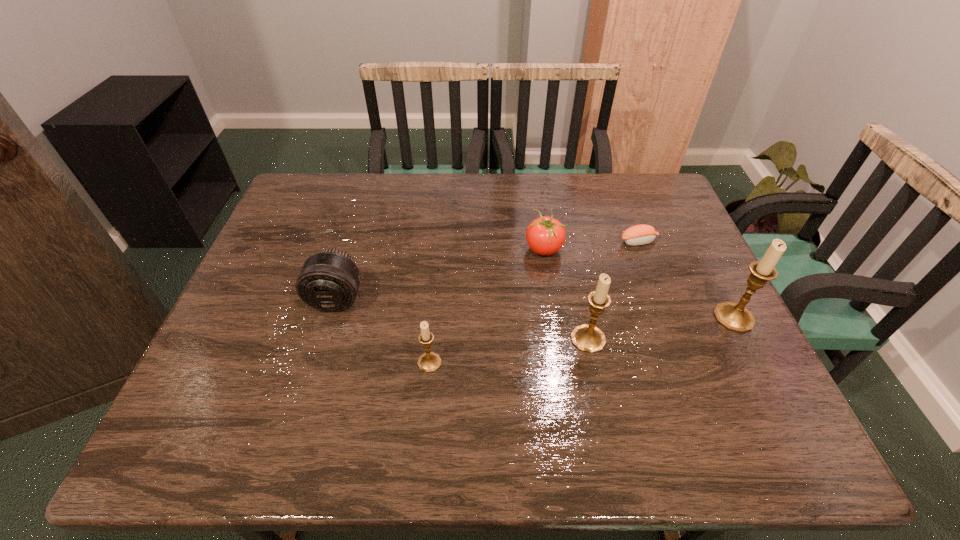
Identify the location of free space at the left edge of the desktop. (293, 248).

The height and width of the screenshot is (540, 960). Find the location of `free space at the right edge`. free space at the right edge is located at coordinates tap(673, 277).

This screenshot has width=960, height=540. What are the coordinates of `free space at the far right corner` in the screenshot? It's located at (644, 215).

You are a GUI agent. You are given a task and a screenshot of the screen. Output one action in this format:
    pyautogui.click(x=<x>, y=<y>)
    Task: Click on the vacant space that's between the shortest object and the rightmost object
    The image size is (960, 540).
    Given the screenshot: What is the action you would take?
    pyautogui.click(x=686, y=280)

What are the coordinates of `empty space that is in between the shortest candle holder and the telephoto lens` in the screenshot? It's located at (383, 330).

Image resolution: width=960 pixels, height=540 pixels. What are the coordinates of `free spot between the second candle holder from right to left and the tomato` in the screenshot? It's located at (566, 294).

Locate an element on the screen. Image resolution: width=960 pixels, height=540 pixels. free space between the second object from left to right and the leftmost object is located at coordinates coord(383,330).

You are a GUI agent. You are given a task and a screenshot of the screen. Output one action in this format:
    pyautogui.click(x=<x>, y=<y>)
    Task: Click on the free space between the rightmost object and the sushi
    
    Given the screenshot: What is the action you would take?
    tap(686, 280)

This screenshot has width=960, height=540. I want to click on vacant space that's between the sushi and the second object from left to right, so click(534, 302).

Locate an element on the screen. The height and width of the screenshot is (540, 960). free space between the telephoto lens and the leftmost candle holder is located at coordinates (383, 330).